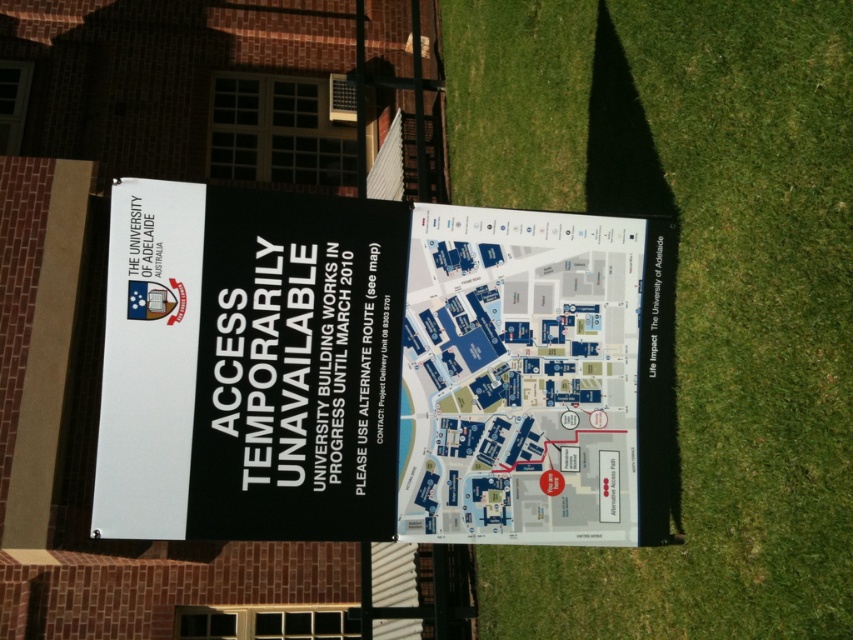
You are a visitor at The University of Adelaide and need to find an alternate route. You see a signboard with a blue paper map at center and green grass at lower right. According to the signboard, where should you look to find the alternate route instructions?

The alternate route instructions are on the map, so you should look at the blue paper map at center. The green grass at lower right is in front of it, but the map itself contains the necessary information.

You are a visitor at The University of Adelaide and see the signboard. You need to find the alternate route mentioned. Which object is closer to you, the green grass at lower right or the black paper sign at upper left?

The green grass at lower right is closer to the viewer than the black paper sign at upper left, so the green grass at lower right is closer.

You are a visitor at The University of Adelaide and need to find an alternate route. You see a black paper sign at upper left and a blue paper map at center. Which object should you look at first for directions?

The blue paper map at center should be looked at first for directions because the text on the black paper sign at upper left mentions to see the map for the alternate route.